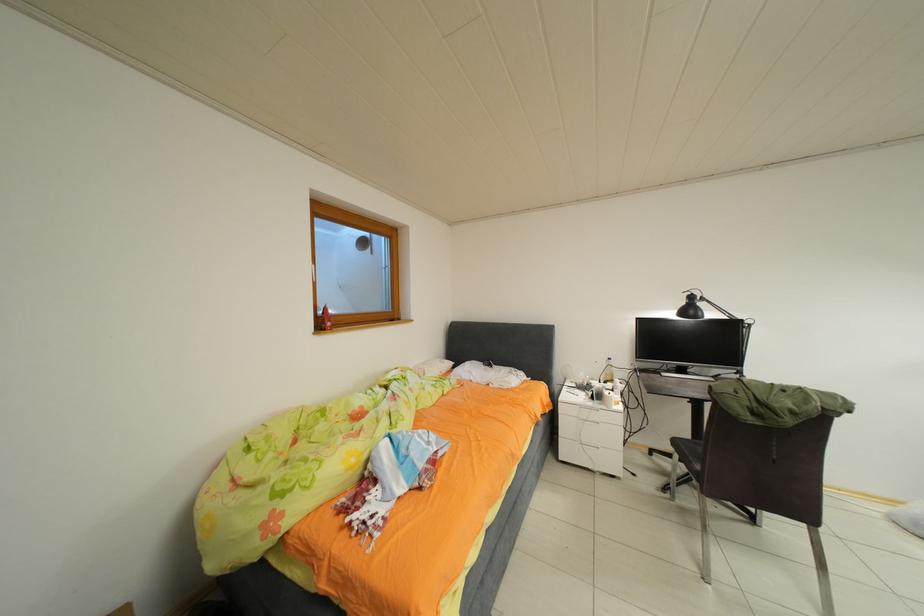
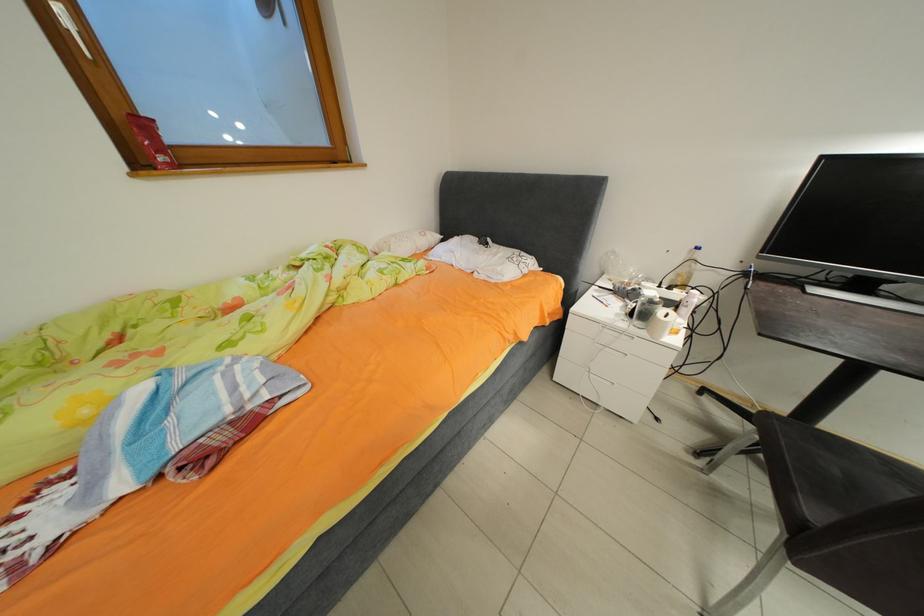
Question: The images are taken continuously from a first-person perspective. In which direction is your viewpoint rotating?

Choices:
 (A) Left
 (B) Right
 (C) Up
 (D) Down

Answer: (D)